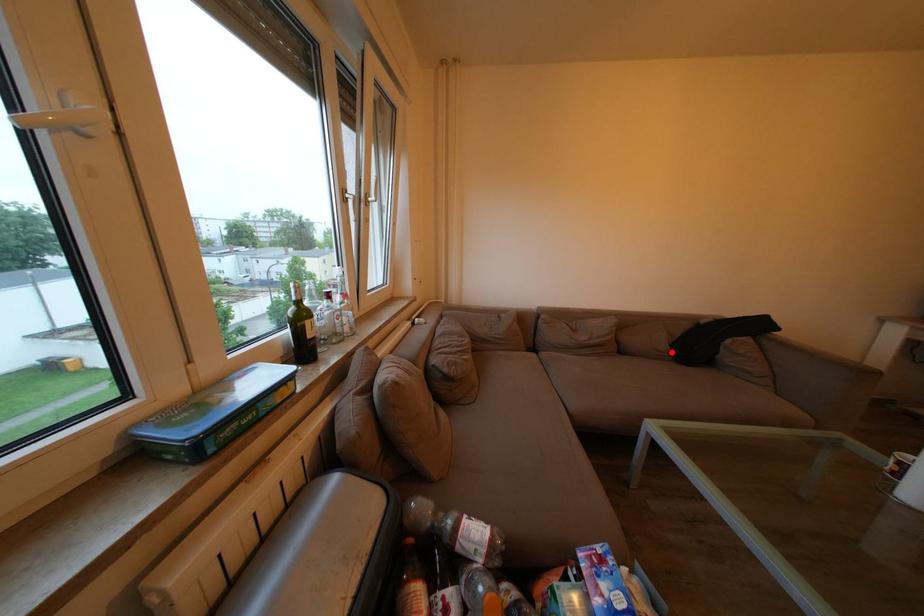
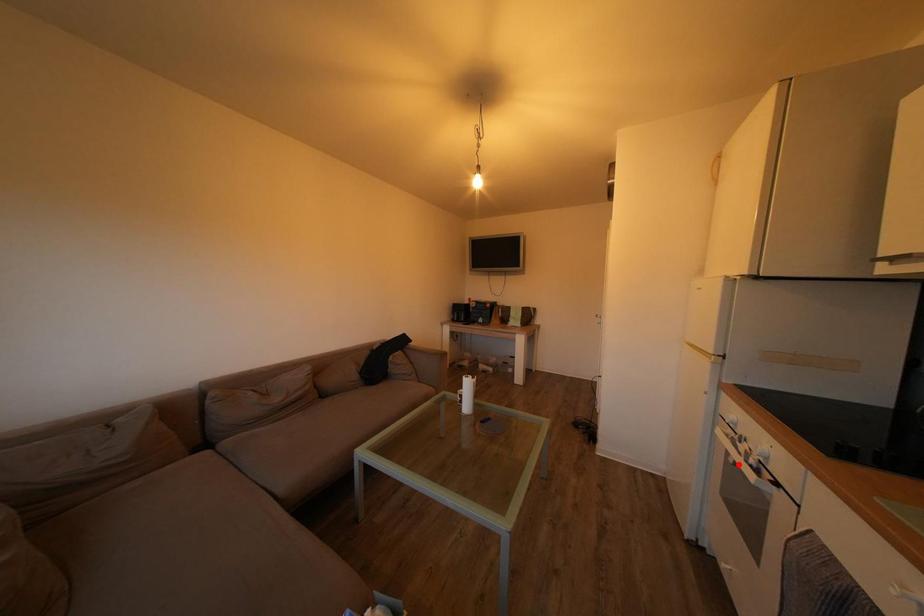
I am providing you with two images of the same scene from different viewpoints. A red point is marked on the first image and another point is marked on the second image. Is the marked point in image1 the same physical position as the marked point in image2?

No